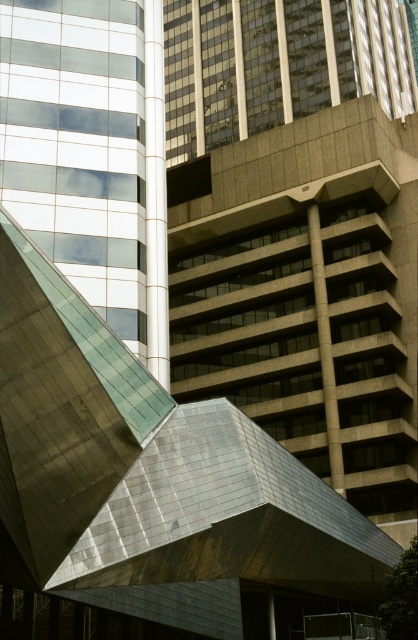
Question: Can you confirm if matte gray building at center is positioned above metallic glass building at left?

Choices:
 (A) yes
 (B) no

Answer: (A)

Question: Does matte gray building at center appear on the right side of metallic glass building at left?

Choices:
 (A) no
 (B) yes

Answer: (B)

Question: In this image, where is matte gray building at center located relative to metallic glass building at left?

Choices:
 (A) right
 (B) left

Answer: (A)

Question: Which point is closer to the camera?

Choices:
 (A) metallic glass building at left
 (B) matte gray building at center

Answer: (A)